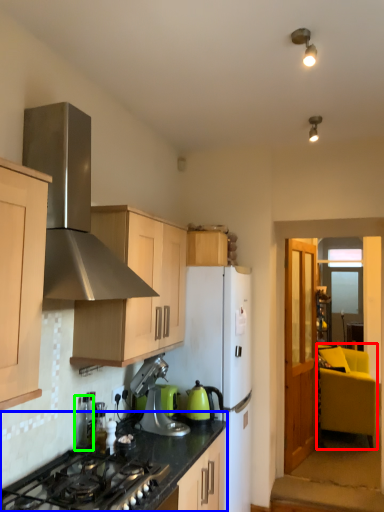
Question: Based on their relative distances, which object is farther from armchair (highlighted by a red box)? Choose from countertop (highlighted by a blue box) and appliance (highlighted by a green box).

Choices:
 (A) countertop
 (B) appliance

Answer: (B)